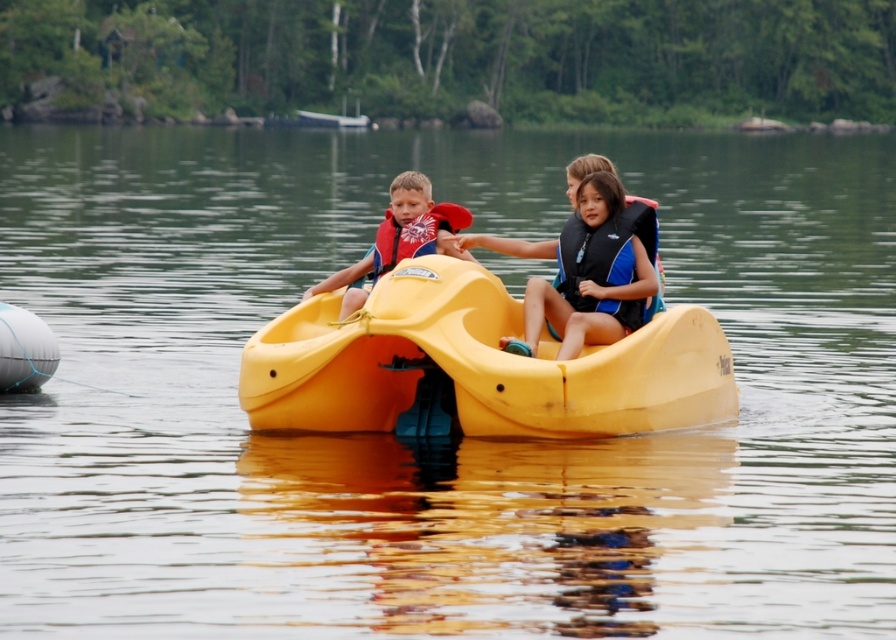
Question: Which object is the closest to the matte red life vest at center?

Choices:
 (A) yellow plastic boat at center
 (B) matte red life jacket at center
 (C) blue/black fabric life jacket at center
 (D) matte blue life vest at center

Answer: (B)

Question: Does yellow plastic boat at center have a larger size compared to matte red life vest at center?

Choices:
 (A) yes
 (B) no

Answer: (A)

Question: Estimate the real-world distances between objects in this image. Which object is closer to the blue/black fabric life jacket at center?

Choices:
 (A) matte red life jacket at center
 (B) matte blue life vest at center
 (C) yellow plastic boat at center
 (D) matte red life vest at center

Answer: (B)

Question: Is blue/black fabric life jacket at center to the left of matte red life vest at center from the viewer's perspective?

Choices:
 (A) yes
 (B) no

Answer: (B)

Question: Based on their relative distances, which object is nearer to the matte red life jacket at center?

Choices:
 (A) matte red life vest at center
 (B) blue/black fabric life jacket at center
 (C) matte blue life vest at center

Answer: (A)

Question: Is yellow plastic boat at center above matte red life jacket at center?

Choices:
 (A) yes
 (B) no

Answer: (B)